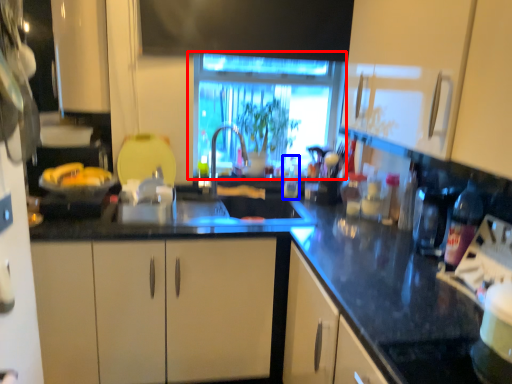
Question: Which point is closer to the camera, window (highlighted by a red box) or bottle (highlighted by a blue box)?

Choices:
 (A) window
 (B) bottle

Answer: (A)